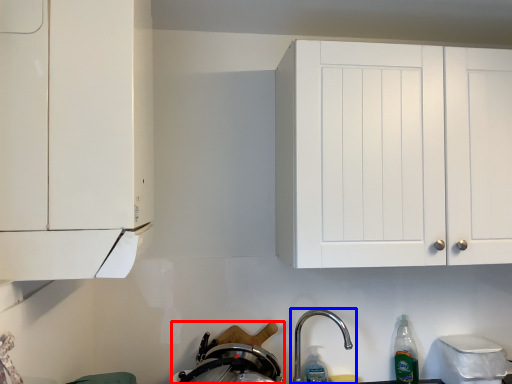
Question: Which object appears closest to the camera in this image, appliance (highlighted by a red box) or tap (highlighted by a blue box)?

Choices:
 (A) appliance
 (B) tap

Answer: (B)